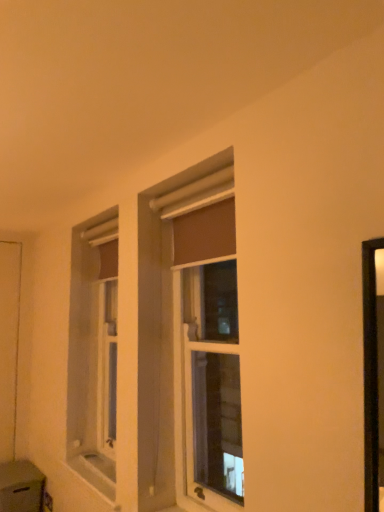
Question: Is white matte screen door at left inside or outside of matte brown curtain at center?

Choices:
 (A) outside
 (B) inside

Answer: (A)

Question: Looking at the image, does white matte screen door at left seem bigger or smaller compared to matte brown curtain at center?

Choices:
 (A) small
 (B) big

Answer: (A)

Question: From their relative heights in the image, would you say white matte screen door at left is taller or shorter than matte brown curtain at center?

Choices:
 (A) tall
 (B) short

Answer: (A)

Question: From a real-world perspective, is matte brown curtain at center positioned above or below white matte screen door at left?

Choices:
 (A) above
 (B) below

Answer: (A)

Question: In terms of height, does matte brown curtain at center look taller or shorter compared to white matte screen door at left?

Choices:
 (A) short
 (B) tall

Answer: (A)

Question: From the image's perspective, is matte brown curtain at center above or below white matte screen door at left?

Choices:
 (A) below
 (B) above

Answer: (B)

Question: Would you say matte brown curtain at center is to the left or to the right of white matte screen door at left in the picture?

Choices:
 (A) left
 (B) right

Answer: (B)